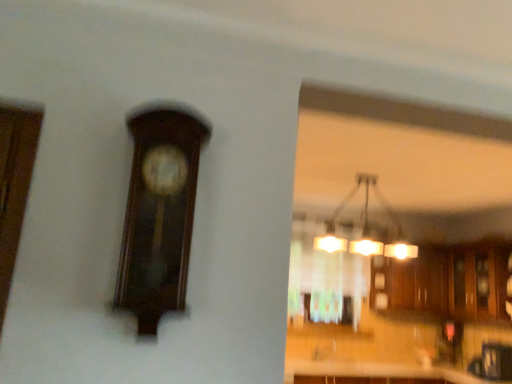
The image size is (512, 384). What do you see at coordinates (445, 281) in the screenshot? I see `wooden cabinets at center` at bounding box center [445, 281].

This screenshot has height=384, width=512. I want to click on dark wood clock at upper left, so click(x=159, y=214).

Is matte glass chandelier at upper center taller than dark wood clock at upper left?

No.

How many degrees apart are the facing directions of matte glass chandelier at upper center and dark wood clock at upper left?

matte glass chandelier at upper center and dark wood clock at upper left are facing 1.57 degrees away from each other.

Is matte glass chandelier at upper center aimed at dark wood clock at upper left?

No, matte glass chandelier at upper center is not turned towards dark wood clock at upper left.

Would you say matte glass chandelier at upper center is a long distance from dark wood clock at upper left?

Yes.

Considering the relative sizes of dark wood clock at upper left and wooden cabinets at center in the image provided, is dark wood clock at upper left thinner than wooden cabinets at center?

Yes.

From a real-world perspective, which object stands above the other?

wooden cabinets at center, from a real-world perspective.

The width and height of the screenshot is (512, 384). I want to click on cabinetry below the translucent glass window at center (from a real-world perspective), so click(445, 281).

How distant is wooden cabinets at center from translucent glass window at center?

They are 28.92 inches apart.

Which is in front, point (461, 300) or point (361, 262)?

Point (461, 300)

From a real-world perspective, who is located lower, wooden cabinets at center or translucent glass window at center?

From a 3D spatial view, wooden cabinets at center is below.

From a real-world perspective, is dark wood clock at upper left physically located above or below matte glass chandelier at upper center?

Clearly, from a real-world perspective, dark wood clock at upper left is below matte glass chandelier at upper center.

How much distance is there between dark wood clock at upper left and matte glass chandelier at upper center?

dark wood clock at upper left and matte glass chandelier at upper center are 11.61 feet apart.

Between dark wood clock at upper left and matte glass chandelier at upper center, which one appears on the right side from the viewer's perspective?

From the viewer's perspective, matte glass chandelier at upper center appears more on the right side.

Which is nearer, (161, 144) or (405, 251)?

The point (161, 144) is closer.

Measure the distance from wooden cabinets at center to matte glass chandelier at upper center.

wooden cabinets at center is 47.84 centimeters from matte glass chandelier at upper center.

Between wooden cabinets at center and matte glass chandelier at upper center, which one has less height?

matte glass chandelier at upper center is shorter.

Based on the photo, from a real-world perspective, is wooden cabinets at center located beneath matte glass chandelier at upper center?

Yes.

Based on the photo, in the image, is translucent glass window at center positioned in front of or behind matte glass chandelier at upper center?

In the image, translucent glass window at center appears behind matte glass chandelier at upper center.

From a real-world perspective, who is located lower, translucent glass window at center or matte glass chandelier at upper center?

In real-world perspective, translucent glass window at center is lower.

How many degrees apart are the facing directions of translucent glass window at center and wooden cabinets at center?

The angle between the facing direction of translucent glass window at center and the facing direction of wooden cabinets at center is 8.36 degrees.

In terms of height, does translucent glass window at center look taller or shorter compared to wooden cabinets at center?

Considering their sizes, translucent glass window at center has less height than wooden cabinets at center.

Is the position of translucent glass window at center less distant than that of wooden cabinets at center?

No, it is not.

Is translucent glass window at center not near wooden cabinets at center?

translucent glass window at center is near wooden cabinets at center, not far away.

In order to click on lamp that appears on the right of dark wood clock at upper left in this screenshot , I will do `click(366, 228)`.

You are a GUI agent. You are given a task and a screenshot of the screen. Output one action in this format:
    pyautogui.click(x=<x>, y=<y>)
    Task: Click on the clock that is above the wooden cabinets at center (from the image's perspective)
    This screenshot has height=384, width=512.
    Given the screenshot: What is the action you would take?
    pyautogui.click(x=159, y=214)

From the image, which object appears to be nearer to matte glass chandelier at upper center, translucent glass window at center or dark wood clock at upper left?

translucent glass window at center is positioned closer to the anchor matte glass chandelier at upper center.

Looking at the image, which one is located further to wooden cabinets at center, translucent glass window at center or dark wood clock at upper left?

dark wood clock at upper left lies further to wooden cabinets at center than the other object.

In the scene shown: Looking at the image, which one is located closer to translucent glass window at center, dark wood clock at upper left or wooden cabinets at center?

wooden cabinets at center lies closer to translucent glass window at center than the other object.

Which object lies further to the anchor point matte glass chandelier at upper center, wooden cabinets at center or dark wood clock at upper left?

dark wood clock at upper left is positioned further to the anchor matte glass chandelier at upper center.

From the image, which object appears to be nearer to dark wood clock at upper left, matte glass chandelier at upper center or translucent glass window at center?

translucent glass window at center is positioned closer to the anchor dark wood clock at upper left.

Looking at the image, which one is located further to translucent glass window at center, matte glass chandelier at upper center or wooden cabinets at center?

Based on the image, wooden cabinets at center appears to be further to translucent glass window at center.

Looking at the image, which one is located further to dark wood clock at upper left, translucent glass window at center or wooden cabinets at center?

Based on the image, wooden cabinets at center appears to be further to dark wood clock at upper left.

Based on their spatial positions, is wooden cabinets at center or translucent glass window at center closer to dark wood clock at upper left?

translucent glass window at center is closer to dark wood clock at upper left.

Find the location of a particular element. Image resolution: width=512 pixels, height=384 pixels. cabinetry between dark wood clock at upper left and translucent glass window at center along the z-axis is located at coordinates [445, 281].

The width and height of the screenshot is (512, 384). Identify the location of lamp between translucent glass window at center and wooden cabinets at center from left to right. (366, 228).

Locate an element on the screen. lamp positioned between dark wood clock at upper left and wooden cabinets at center from near to far is located at coordinates (366, 228).

This screenshot has height=384, width=512. I want to click on lamp between dark wood clock at upper left and translucent glass window at center from front to back, so (x=366, y=228).